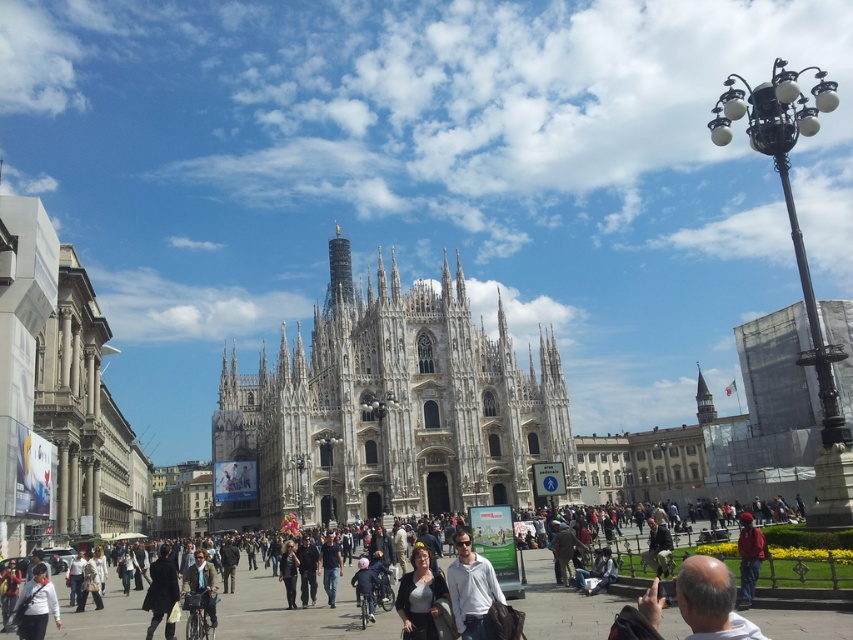
Question: Considering the real-world distances, which object is farthest from the matte black jacket at center?

Choices:
 (A) white stone church at center
 (B) white matte jacket at center
 (C) dark gray clothing at center

Answer: (A)

Question: Is dark gray clothing at center bigger than matte brown jacket at center?

Choices:
 (A) yes
 (B) no

Answer: (A)

Question: Among these points, which one is nearest to the camera?

Choices:
 (A) (x=115, y=612)
 (B) (x=201, y=616)
 (C) (x=415, y=589)
 (D) (x=57, y=612)

Answer: (C)

Question: Observing the image, what is the correct spatial positioning of dark gray clothing at center in reference to white matte jacket at lower left?

Choices:
 (A) below
 (B) above

Answer: (A)

Question: Is white matte jacket at lower left wider than red fabric jacket at lower right?

Choices:
 (A) yes
 (B) no

Answer: (B)

Question: Which point appears closest to the camera in this image?

Choices:
 (A) (413, 593)
 (B) (747, 547)

Answer: (A)